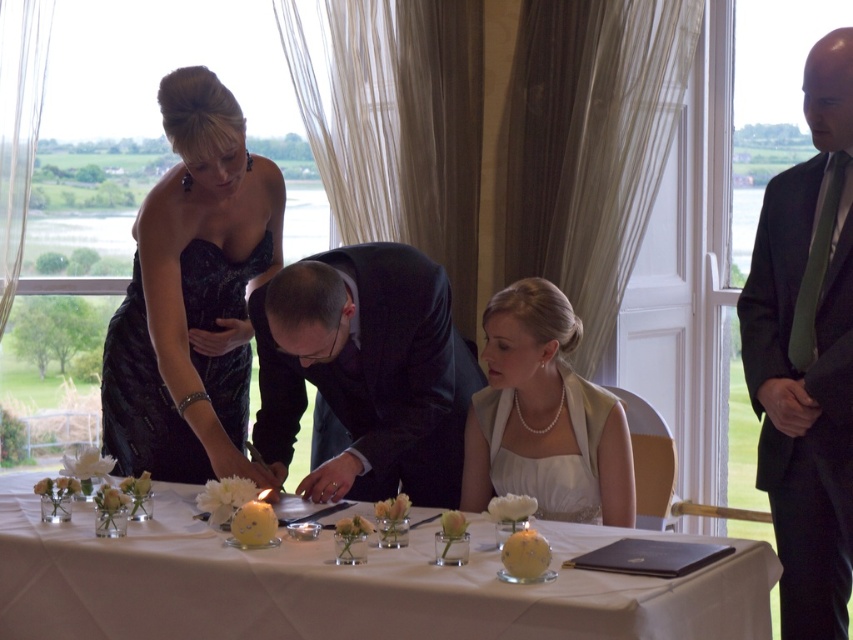
Question: Considering the real-world distances, which object is closest to the dark suit at right?

Choices:
 (A) pearl necklace at center
 (B) white glass table at center
 (C) black satin dress at upper left
 (D) dark suit at center

Answer: (A)

Question: Is white glass table at center thinner than dark suit at right?

Choices:
 (A) no
 (B) yes

Answer: (A)

Question: Does white glass table at center have a larger size compared to dark suit at right?

Choices:
 (A) yes
 (B) no

Answer: (A)

Question: Can you confirm if white glass table at center is wider than dark suit at right?

Choices:
 (A) yes
 (B) no

Answer: (A)

Question: Which object appears farthest from the camera in this image?

Choices:
 (A) dark suit at center
 (B) black satin dress at upper left
 (C) white glass table at center

Answer: (A)

Question: Which point is farther to the camera?

Choices:
 (A) pearl necklace at center
 (B) dark suit at right

Answer: (A)